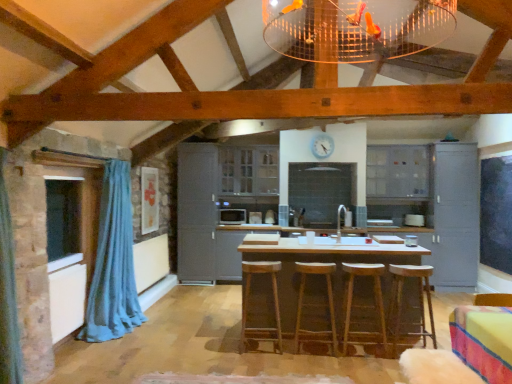
I want to click on free space that is in between brown wooden bar stool at center, placed as the 1th bar stool when sorted from left to right, and blue fabric curtain at left, so tap(179, 338).